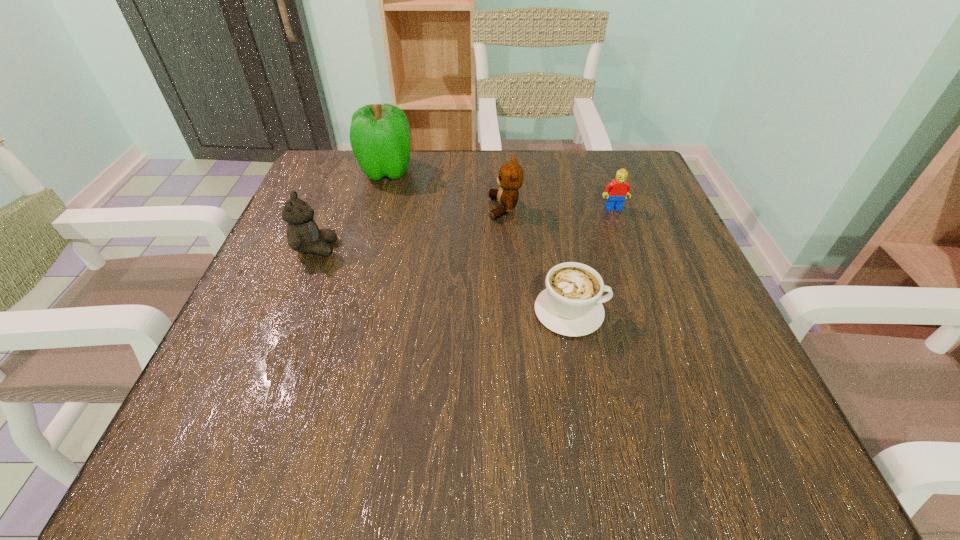
Find the location of a particular element. bell pepper at the left edge is located at coordinates [379, 134].

At what (x,y) coordinates should I click in order to perform the action: click on teddy bear at the left edge. Please return your answer as a coordinate pair (x, y). The image size is (960, 540). Looking at the image, I should click on (303, 234).

You are a GUI agent. You are given a task and a screenshot of the screen. Output one action in this format:
    pyautogui.click(x=<x>, y=<y>)
    Task: Click on the object present at the right edge
    The image size is (960, 540).
    Given the screenshot: What is the action you would take?
    pyautogui.click(x=616, y=191)

Locate an element on the screen. object present at the far left corner is located at coordinates (379, 134).

The width and height of the screenshot is (960, 540). What are the coordinates of `object situated at the far right corner` in the screenshot? It's located at (616, 191).

The width and height of the screenshot is (960, 540). Find the location of `free space at the far edge of the desktop`. free space at the far edge of the desktop is located at coordinates (427, 156).

Identify the location of free spot at the near edge of the desktop. The image size is (960, 540). (436, 437).

Identify the location of vacant space at the left edge of the desktop. (256, 401).

Identify the location of free space at the right edge of the desktop. (650, 355).

Locate an element on the screen. The width and height of the screenshot is (960, 540). free spot at the far left corner of the desktop is located at coordinates (343, 164).